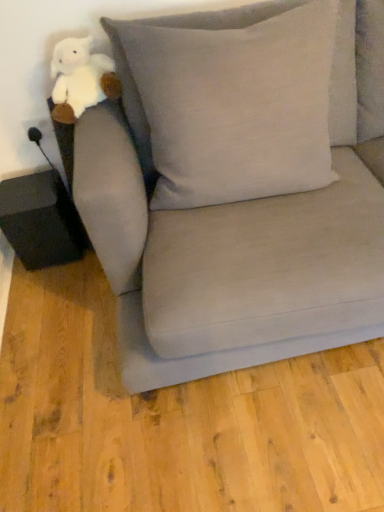
Measure the distance between light gray linen pillow at upper center and camera.

The depth of light gray linen pillow at upper center is 1.10 meters.

What do you see at coordinates (80, 79) in the screenshot? I see `white plush toy at upper left` at bounding box center [80, 79].

What is the approximate width of white plush toy at upper left?

8.42 inches.

Locate an element on the screen. This screenshot has height=512, width=384. matte gray couch at center is located at coordinates (236, 194).

You are a GUI agent. You are given a task and a screenshot of the screen. Output one action in this format:
    pyautogui.click(x=<x>, y=<y>)
    Task: Click on the light gray linen pillow at upper center
    
    Given the screenshot: What is the action you would take?
    pyautogui.click(x=236, y=106)

Is matte gray couch at center not inside white plush toy at upper left?

Indeed, matte gray couch at center is completely outside white plush toy at upper left.

From the picture: Considering the sizes of objects matte gray couch at center and white plush toy at upper left in the image provided, who is taller, matte gray couch at center or white plush toy at upper left?

matte gray couch at center.

From the image's perspective, relative to white plush toy at upper left, is matte gray couch at center above or below?

matte gray couch at center is below white plush toy at upper left.

Which is more to the left, matte gray couch at center or white plush toy at upper left?

white plush toy at upper left.

Who is bigger, light gray linen pillow at upper center or white plush toy at upper left?

light gray linen pillow at upper center.

Is light gray linen pillow at upper center far from white plush toy at upper left?

They are positioned close to each other.

Does light gray linen pillow at upper center turn towards white plush toy at upper left?

No, light gray linen pillow at upper center is not turned towards white plush toy at upper left.

Considering the sizes of objects light gray linen pillow at upper center and white plush toy at upper left in the image provided, who is taller, light gray linen pillow at upper center or white plush toy at upper left?

light gray linen pillow at upper center is taller.

Is matte gray couch at center turned away from light gray linen pillow at upper center?

Correct, matte gray couch at center is looking away from light gray linen pillow at upper center.

Between matte gray couch at center and light gray linen pillow at upper center, which one has larger width?

With larger width is matte gray couch at center.

Between matte gray couch at center and light gray linen pillow at upper center, which one has more height?

Standing taller between the two is matte gray couch at center.

You are a GUI agent. You are given a task and a screenshot of the screen. Output one action in this format:
    pyautogui.click(x=<x>, y=<y>)
    Task: Click on the studio couch located underneath the white plush toy at upper left (from a real-world perspective)
    
    Given the screenshot: What is the action you would take?
    pyautogui.click(x=236, y=194)

Is white plush toy at upper left next to matte gray couch at center and touching it?

white plush toy at upper left and matte gray couch at center are not in contact.

Considering the sizes of objects white plush toy at upper left and matte gray couch at center in the image provided, who is taller, white plush toy at upper left or matte gray couch at center?

matte gray couch at center is taller.

Is point (68, 65) less distant than point (302, 22)?

That is False.

Between light gray linen pillow at upper center and matte gray couch at center, which one has less height?

light gray linen pillow at upper center.

Measure the distance from light gray linen pillow at upper center to matte gray couch at center.

The distance of light gray linen pillow at upper center from matte gray couch at center is 4.18 inches.

Is light gray linen pillow at upper center looking in the opposite direction of matte gray couch at center?

That's right, light gray linen pillow at upper center is facing away from matte gray couch at center.

This screenshot has height=512, width=384. Identify the location of studio couch in front of the light gray linen pillow at upper center. (236, 194).

Considering the sizes of objects white plush toy at upper left and light gray linen pillow at upper center in the image provided, who is bigger, white plush toy at upper left or light gray linen pillow at upper center?

With larger size is light gray linen pillow at upper center.

Considering the relative sizes of white plush toy at upper left and light gray linen pillow at upper center in the image provided, is white plush toy at upper left wider than light gray linen pillow at upper center?

Incorrect, the width of white plush toy at upper left does not surpass that of light gray linen pillow at upper center.

Which is correct: white plush toy at upper left is inside light gray linen pillow at upper center, or outside of it?

white plush toy at upper left cannot be found inside light gray linen pillow at upper center.

Between white plush toy at upper left and light gray linen pillow at upper center, which one has less height?

white plush toy at upper left is shorter.

The image size is (384, 512). Find the location of `studio couch below the white plush toy at upper left (from a real-world perspective)`. studio couch below the white plush toy at upper left (from a real-world perspective) is located at coordinates (236, 194).

Identify the location of pillow on the right of white plush toy at upper left. [x=236, y=106].

From the image, which object appears to be farther from matte gray couch at center, white plush toy at upper left or light gray linen pillow at upper center?

white plush toy at upper left is further to matte gray couch at center.

Based on their spatial positions, is light gray linen pillow at upper center or matte gray couch at center further from white plush toy at upper left?

matte gray couch at center is positioned further to the anchor white plush toy at upper left.

Based on their spatial positions, is white plush toy at upper left or matte gray couch at center closer to light gray linen pillow at upper center?

Among the two, matte gray couch at center is located nearer to light gray linen pillow at upper center.

From the image, which object appears to be nearer to light gray linen pillow at upper center, matte gray couch at center or white plush toy at upper left?

The object closer to light gray linen pillow at upper center is matte gray couch at center.

When comparing their distances from white plush toy at upper left, does matte gray couch at center or light gray linen pillow at upper center seem closer?

Based on the image, light gray linen pillow at upper center appears to be nearer to white plush toy at upper left.

Looking at the image, which one is located further to matte gray couch at center, light gray linen pillow at upper center or white plush toy at upper left?

Among the two, white plush toy at upper left is located further to matte gray couch at center.

Locate an element on the screen. The width and height of the screenshot is (384, 512). pillow situated between white plush toy at upper left and matte gray couch at center from left to right is located at coordinates (236, 106).